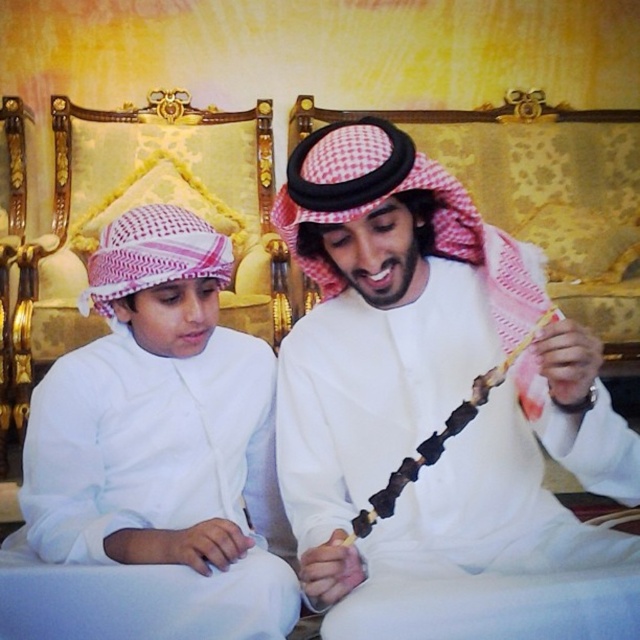
Question: Is white matte kebab skewer at center thinner than white matte keffiyeh at center?

Choices:
 (A) yes
 (B) no

Answer: (B)

Question: Among these objects, which one is farthest from the camera?

Choices:
 (A) white matte kebab skewer at center
 (B) white matte keffiyeh at center

Answer: (B)

Question: From the image, what is the correct spatial relationship of white matte kebab skewer at center in relation to white matte keffiyeh at center?

Choices:
 (A) above
 (B) below

Answer: (A)

Question: Is white matte kebab skewer at center smaller than white matte keffiyeh at center?

Choices:
 (A) yes
 (B) no

Answer: (B)

Question: Which of the following is the closest to the observer?

Choices:
 (A) (65, 448)
 (B) (540, 337)

Answer: (B)